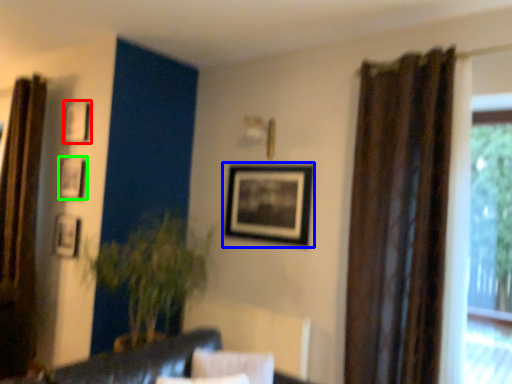
Question: Which is nearer to the picture frame (highlighted by a red box)? picture frame (highlighted by a blue box) or picture frame (highlighted by a green box).

Choices:
 (A) picture frame
 (B) picture frame

Answer: (B)